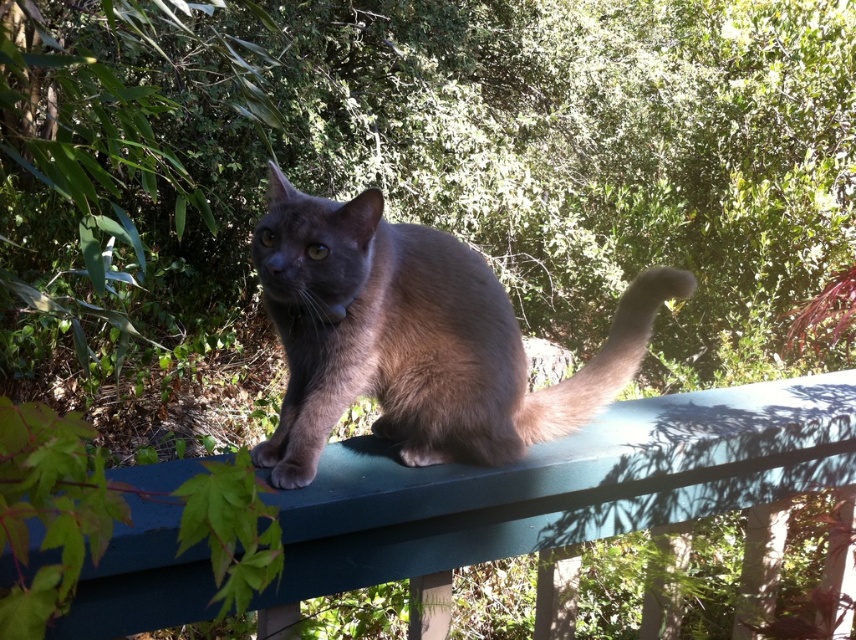
Question: Among these objects, which one is farthest from the camera?

Choices:
 (A) matte gray cat at center
 (B) green painted wood at center

Answer: (A)

Question: From the image, what is the correct spatial relationship of green painted wood at center in relation to matte gray cat at center?

Choices:
 (A) above
 (B) below

Answer: (B)

Question: Which point is closer to the camera?

Choices:
 (A) (608, 349)
 (B) (128, 556)
 (C) (477, 365)

Answer: (B)

Question: Considering the real-world distances, which object is farthest from the fuzzy brown tail at upper center?

Choices:
 (A) green painted wood at center
 (B) matte gray cat at center

Answer: (A)

Question: Does matte gray cat at center have a greater width compared to fuzzy brown tail at upper center?

Choices:
 (A) yes
 (B) no

Answer: (A)

Question: Is green painted wood at center closer to camera compared to matte gray cat at center?

Choices:
 (A) no
 (B) yes

Answer: (B)